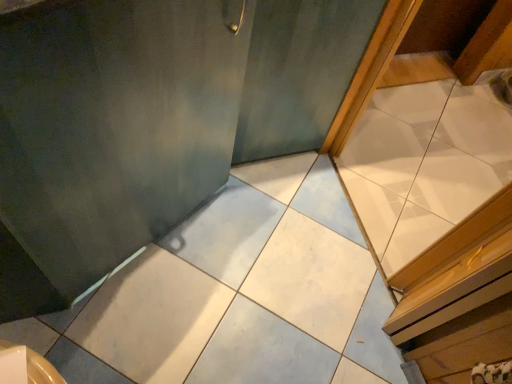
The image size is (512, 384). Describe the element at coordinates (425, 163) in the screenshot. I see `white glossy tile at lower right` at that location.

The image size is (512, 384). I want to click on white glossy tile at lower right, so click(425, 163).

What is the approximate height of white glossy tile at lower right?

33.11 inches.

In order to click on white glossy tile at lower right in this screenshot , I will do `click(425, 163)`.